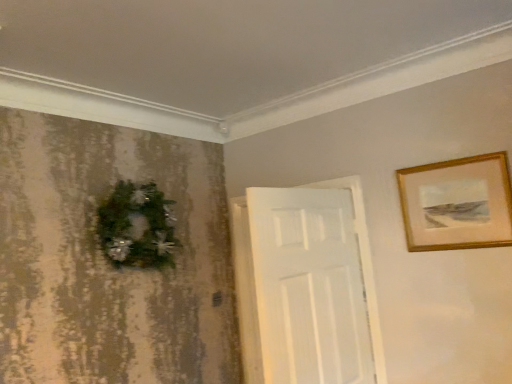
The height and width of the screenshot is (384, 512). I want to click on green matte wreath at left, so click(x=136, y=227).

What is the approximate height of green matte wreath at left?

The height of green matte wreath at left is 21.02 inches.

Describe the element at coordinates (136, 227) in the screenshot. I see `green matte wreath at left` at that location.

Describe the element at coordinates (458, 204) in the screenshot. I see `gold wooden picture frame at upper right` at that location.

This screenshot has width=512, height=384. What are the coordinates of `gold wooden picture frame at upper right` in the screenshot? It's located at 458,204.

Identify the location of green matte wreath at left. The image size is (512, 384). (136, 227).

Is green matte wreath at left to the left or to the right of gold wooden picture frame at upper right in the image?

In the image, green matte wreath at left appears on the left side of gold wooden picture frame at upper right.

Which is behind, green matte wreath at left or gold wooden picture frame at upper right?

green matte wreath at left is behind.

Considering the positions of point (145, 184) and point (433, 213), is point (145, 184) closer or farther from the camera than point (433, 213)?

Point (145, 184).

From the image's perspective, which object appears higher, green matte wreath at left or gold wooden picture frame at upper right?

From the image's view, gold wooden picture frame at upper right is above.

From a real-world perspective, is green matte wreath at left positioned above or below gold wooden picture frame at upper right?

In terms of real-world spatial position, green matte wreath at left is above gold wooden picture frame at upper right.

Is green matte wreath at left thinner than gold wooden picture frame at upper right?

Incorrect, the width of green matte wreath at left is not less than that of gold wooden picture frame at upper right.

Between green matte wreath at left and gold wooden picture frame at upper right, which one has more height?

green matte wreath at left.

Can you confirm if green matte wreath at left is smaller than gold wooden picture frame at upper right?

No.

Is green matte wreath at left situated inside gold wooden picture frame at upper right or outside?

green matte wreath at left exists outside the volume of gold wooden picture frame at upper right.

Is there a large distance between green matte wreath at left and gold wooden picture frame at upper right?

Absolutely, green matte wreath at left is distant from gold wooden picture frame at upper right.

Could you tell me if green matte wreath at left is turned towards gold wooden picture frame at upper right?

Yes, green matte wreath at left faces towards gold wooden picture frame at upper right.

How many degrees apart are the facing directions of green matte wreath at left and gold wooden picture frame at upper right?

The angular difference between green matte wreath at left and gold wooden picture frame at upper right is 90 degrees.

Where is `christmas decoration to the left of gold wooden picture frame at upper right`? christmas decoration to the left of gold wooden picture frame at upper right is located at coordinates (136, 227).

Considering the relative positions of gold wooden picture frame at upper right and green matte wreath at left in the image provided, is gold wooden picture frame at upper right to the left or to the right of green matte wreath at left?

Based on their positions, gold wooden picture frame at upper right is located to the right of green matte wreath at left.

In the image, is gold wooden picture frame at upper right positioned in front of or behind green matte wreath at left?

gold wooden picture frame at upper right is positioned closer to the viewer than green matte wreath at left.

Is point (414, 174) less distant than point (148, 248)?

That is True.

From the image's perspective, between gold wooden picture frame at upper right and green matte wreath at left, which one is located above?

gold wooden picture frame at upper right.

From a real-world perspective, which object rests below the other?

In real-world perspective, gold wooden picture frame at upper right is lower.

Considering the sizes of objects gold wooden picture frame at upper right and green matte wreath at left in the image provided, who is wider, gold wooden picture frame at upper right or green matte wreath at left?

green matte wreath at left.

Which of these two, gold wooden picture frame at upper right or green matte wreath at left, stands shorter?

gold wooden picture frame at upper right.

Based on their sizes in the image, would you say gold wooden picture frame at upper right is bigger or smaller than green matte wreath at left?

Clearly, gold wooden picture frame at upper right is smaller in size than green matte wreath at left.

Is green matte wreath at left inside gold wooden picture frame at upper right?

No.

Are gold wooden picture frame at upper right and green matte wreath at left far apart?

gold wooden picture frame at upper right is far away from green matte wreath at left.

Looking at this image, could you tell me if gold wooden picture frame at upper right is facing green matte wreath at left?

No, gold wooden picture frame at upper right is not aimed at green matte wreath at left.

This screenshot has height=384, width=512. Identify the location of picture frame in front of the green matte wreath at left. (458, 204).

Where is `christmas decoration lying on the left of gold wooden picture frame at upper right`? christmas decoration lying on the left of gold wooden picture frame at upper right is located at coordinates (136, 227).

Locate an element on the screen. picture frame on the right of green matte wreath at left is located at coordinates (458, 204).